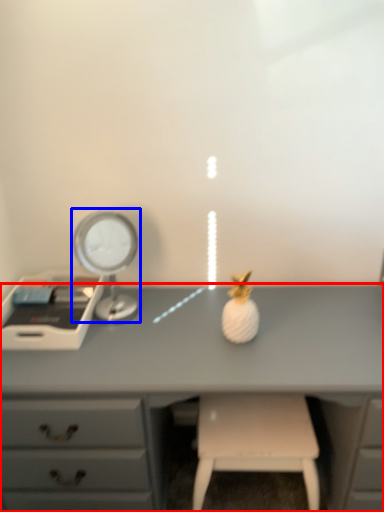
Question: Among these objects, which one is farthest to the camera, desk (highlighted by a red box) or bedside lamp (highlighted by a blue box)?

Choices:
 (A) desk
 (B) bedside lamp

Answer: (B)